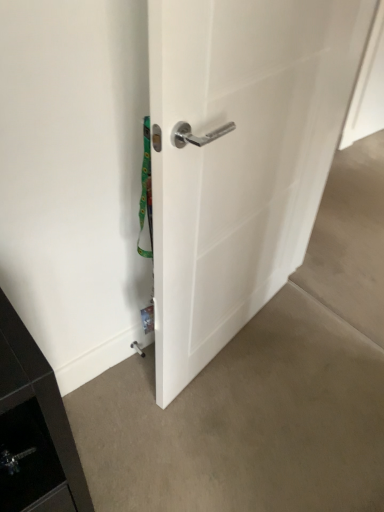
Locate an element on the screen. free region under white glossy door handle at center (from a real-world perspective) is located at coordinates (238, 332).